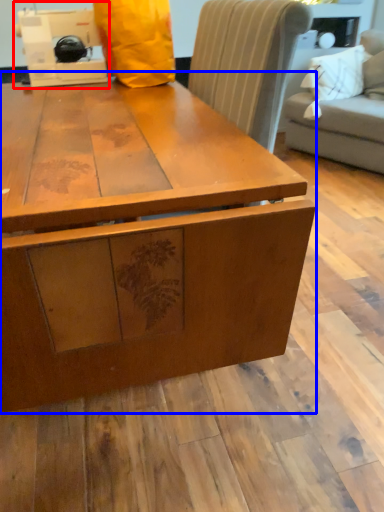
Question: Which point is closer to the camera, sewing machine (highlighted by a red box) or table (highlighted by a blue box)?

Choices:
 (A) sewing machine
 (B) table

Answer: (B)